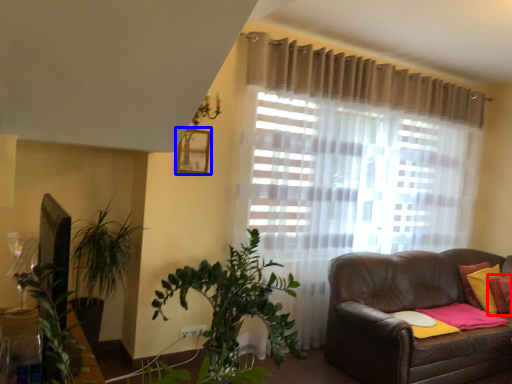
Question: Which object is closer to the camera taking this photo, pillow (highlighted by a red box) or picture frame (highlighted by a blue box)?

Choices:
 (A) pillow
 (B) picture frame

Answer: (B)